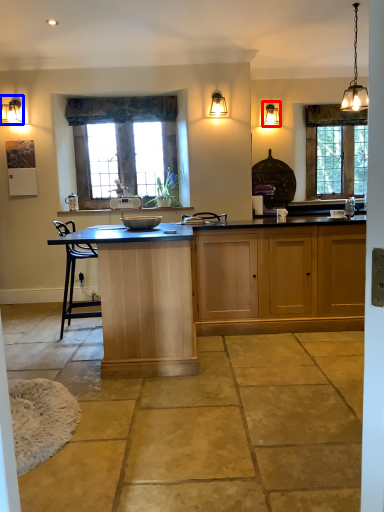
Question: Which point is further to the camera, light fixture (highlighted by a red box) or lamp (highlighted by a blue box)?

Choices:
 (A) light fixture
 (B) lamp

Answer: (A)